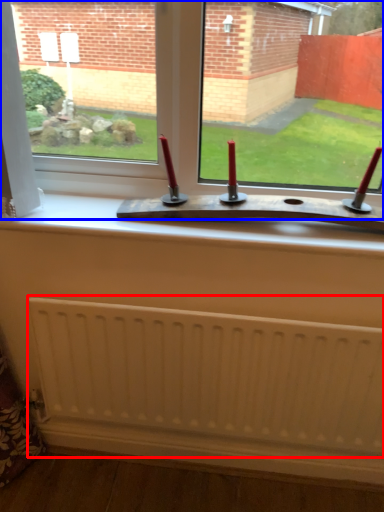
Question: Which object is further to the camera taking this photo, radiator (highlighted by a red box) or window (highlighted by a blue box)?

Choices:
 (A) radiator
 (B) window

Answer: (A)